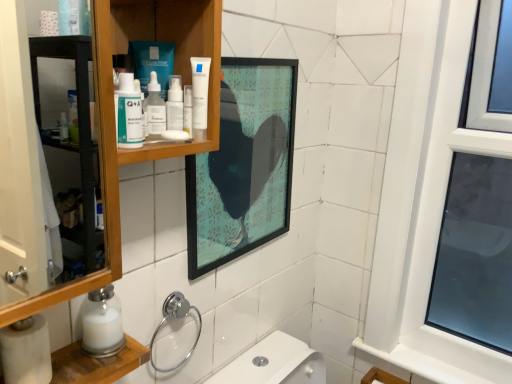
Identify the location of transparent plastic bottle at upper center. This screenshot has width=512, height=384. (154, 108).

Image resolution: width=512 pixels, height=384 pixels. Describe the element at coordinates (154, 108) in the screenshot. I see `transparent plastic bottle at upper center` at that location.

The width and height of the screenshot is (512, 384). Find the location of `matte plastic q+a bottle at upper left`. matte plastic q+a bottle at upper left is located at coordinates (142, 108).

The width and height of the screenshot is (512, 384). I want to click on matte glass picture frame at upper center, so (x=243, y=165).

From the image's perspective, is wooden cabinet at upper left over matte plastic q+a bottle at upper left?

No.

Between wooden cabinet at upper left and matte plastic q+a bottle at upper left, which one is positioned in front?

wooden cabinet at upper left.

Which object is positioned more to the left, wooden cabinet at upper left or matte plastic q+a bottle at upper left?

wooden cabinet at upper left.

What's the angular difference between wooden cabinet at upper left and matte plastic q+a bottle at upper left's facing directions?

The angular difference between wooden cabinet at upper left and matte plastic q+a bottle at upper left is 1.21 degrees.

Can you confirm if white matte tube at upper center is shorter than white frosted glass candle at lower left?

In fact, white matte tube at upper center may be taller than white frosted glass candle at lower left.

Is white matte tube at upper center outside of white frosted glass candle at lower left?

Yes.

What are the coordinates of `toothpaste behind the white frosted glass candle at lower left` in the screenshot? It's located at (200, 92).

Can you tell me how much white matte tube at upper center and white frosted glass candle at lower left differ in facing direction?

They differ by 1.16 degrees in their facing directions.

Would you say white matte tube at upper center is inside or outside matte glass picture frame at upper center?

white matte tube at upper center is located beyond the bounds of matte glass picture frame at upper center.

Is white matte tube at upper center in contact with matte glass picture frame at upper center?

No, white matte tube at upper center is not beside matte glass picture frame at upper center.

From a real-world perspective, is white matte tube at upper center positioned above or below matte glass picture frame at upper center?

white matte tube at upper center is above matte glass picture frame at upper center.

The image size is (512, 384). In order to click on toothpaste lying in front of the matte glass picture frame at upper center in this screenshot , I will do `click(200, 92)`.

From the image's perspective, between matte glass picture frame at upper center and white matte tube at upper center, who is located below?

From the image's view, matte glass picture frame at upper center is below.

Can you tell me how much matte glass picture frame at upper center and white matte tube at upper center differ in facing direction?

They differ by 1.56 degrees in their facing directions.

Image resolution: width=512 pixels, height=384 pixels. In order to click on toothpaste on the left of the matte glass picture frame at upper center in this screenshot , I will do tap(200, 92).

Does white glossy lotion at upper center turn towards transparent plastic bottle at upper center?

No, white glossy lotion at upper center is not facing towards transparent plastic bottle at upper center.

From the image's perspective, is white glossy lotion at upper center over transparent plastic bottle at upper center?

Indeed, from the image's perspective, white glossy lotion at upper center is shown above transparent plastic bottle at upper center.

Is there a large distance between white glossy lotion at upper center and transparent plastic bottle at upper center?

No, white glossy lotion at upper center is not far from transparent plastic bottle at upper center.

Find the location of a particular element. Image resolution: width=512 pixels, height=384 pixels. mouthwash located on the right of white glossy lotion at upper center is located at coordinates (154, 108).

In the image, is chrome/metallic towel ring at lower center positioned in front of or behind wooden cabinet at upper left?

chrome/metallic towel ring at lower center is behind wooden cabinet at upper left.

Looking at their sizes, would you say chrome/metallic towel ring at lower center is wider or thinner than wooden cabinet at upper left?

In the image, chrome/metallic towel ring at lower center appears to be more narrow than wooden cabinet at upper left.

Is chrome/metallic towel ring at lower center taller than wooden cabinet at upper left?

No.

Considering the positions of objects chrome/metallic towel ring at lower center and wooden cabinet at upper left in the image provided, who is more to the right, chrome/metallic towel ring at lower center or wooden cabinet at upper left?

Positioned to the right is chrome/metallic towel ring at lower center.

Does point (147, 130) come closer to viewer compared to point (165, 318)?

That is True.

How different are the orientations of matte plastic q+a bottle at upper left and chrome/metallic towel ring at lower center in degrees?

There is a 0.791-degree angle between the facing directions of matte plastic q+a bottle at upper left and chrome/metallic towel ring at lower center.

Locate an element on the screen. plumbing fixture that is under the matte plastic q+a bottle at upper left (from a real-world perspective) is located at coordinates coord(176,318).

The image size is (512, 384). What are the coordinates of `toiletry on the right of wooden cabinet at upper left` in the screenshot? It's located at (142, 108).

The width and height of the screenshot is (512, 384). I want to click on toothpaste lying behind the white frosted glass candle at lower left, so click(x=200, y=92).

Estimate the real-world distances between objects in this image. Which object is further from white glossy lotion at upper center, matte plastic q+a bottle at upper left or wooden cabinet at upper left?

Among the two, wooden cabinet at upper left is located further to white glossy lotion at upper center.

Based on their spatial positions, is matte plastic q+a bottle at upper left or white frosted glass candle at lower left further from white matte tube at upper center?

white frosted glass candle at lower left is positioned further to the anchor white matte tube at upper center.

Consider the image. Based on their spatial positions, is chrome/metallic towel ring at lower center or matte glass picture frame at upper center closer to transparent plastic bottle at upper center?

matte glass picture frame at upper center is closer to transparent plastic bottle at upper center.

From the image, which object appears to be farther from chrome/metallic towel ring at lower center, wooden cabinet at upper left or matte plastic q+a bottle at upper left?

Among the two, matte plastic q+a bottle at upper left is located further to chrome/metallic towel ring at lower center.

Which object lies further to the anchor point white frosted glass candle at lower left, matte plastic q+a bottle at upper left or transparent plastic bottle at upper center?

Among the two, transparent plastic bottle at upper center is located further to white frosted glass candle at lower left.

Looking at this image, when comparing their distances from white glossy lotion at upper center, does wooden cabinet at upper left or chrome/metallic towel ring at lower center seem closer?

wooden cabinet at upper left lies closer to white glossy lotion at upper center than the other object.

When comparing their distances from chrome/metallic towel ring at lower center, does matte glass picture frame at upper center or white glossy lotion at upper center seem closer?

Answer: Based on the image, matte glass picture frame at upper center appears to be nearer to chrome/metallic towel ring at lower center.

Considering their positions, is chrome/metallic towel ring at lower center positioned closer to matte glass picture frame at upper center than white matte tube at upper center?

chrome/metallic towel ring at lower center is closer to matte glass picture frame at upper center.

In order to click on mouthwash between white matte tube at upper center and matte glass picture frame at upper center along the z-axis in this screenshot , I will do `click(154, 108)`.

This screenshot has height=384, width=512. I want to click on picture frame between white matte tube at upper center and white frosted glass candle at lower left from top to bottom, so (243, 165).

The height and width of the screenshot is (384, 512). In order to click on toiletry between white glossy lotion at upper center and white frosted glass candle at lower left in the up-down direction in this screenshot , I will do `click(142, 108)`.

This screenshot has width=512, height=384. Identify the location of toothpaste between white glossy lotion at upper center and white frosted glass candle at lower left from top to bottom. (200, 92).